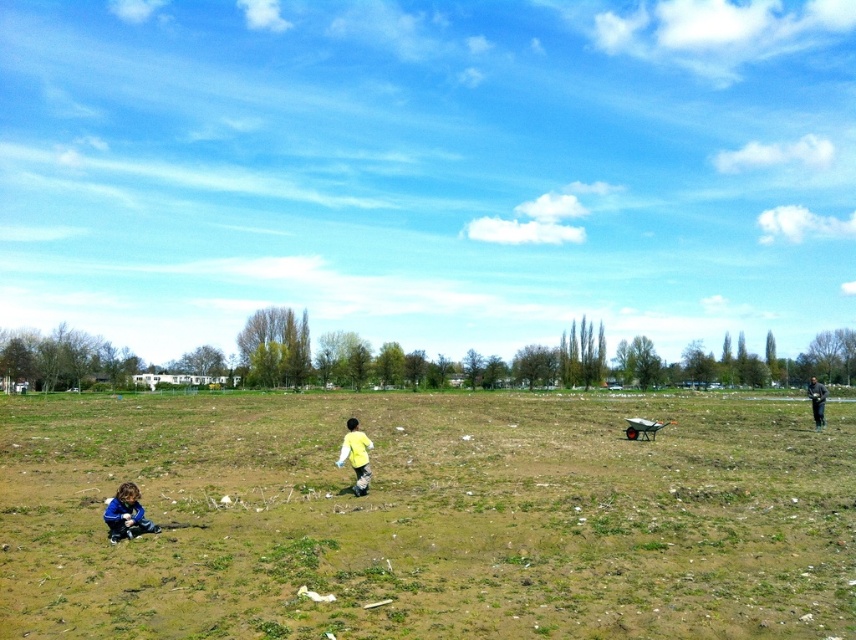
Looking at this image, you are standing at the bottom left corner of the field and want to walk to the green grass at center. According to the coordinates provided, in which direction should you move first?

The green grass at center is located at coordinates point (428, 516). Since you are at the bottom left corner, you should move towards the right and slightly upwards to reach the green grass at center.

You are standing at the bottom left corner of the field where the child in the blue jacket is crouched. You want to walk straight towards the center of the field. Will you step onto the green grass at center before reaching the middle of the field?

The green grass at center is located at point (428, 516). Since you are starting from the bottom left corner, walking straight towards the center would lead you to the green grass at center before reaching the middle of the field.

From the picture: You are standing at the point labeled point (187, 618) and want to walk towards the point labeled point (821, 406). Since you can see both points from your current position, which direction should you face to walk directly towards the second point?

To walk directly towards point (821, 406) from point (187, 618), you should face upwards because point (821, 406) is above point (187, 618) in the image.